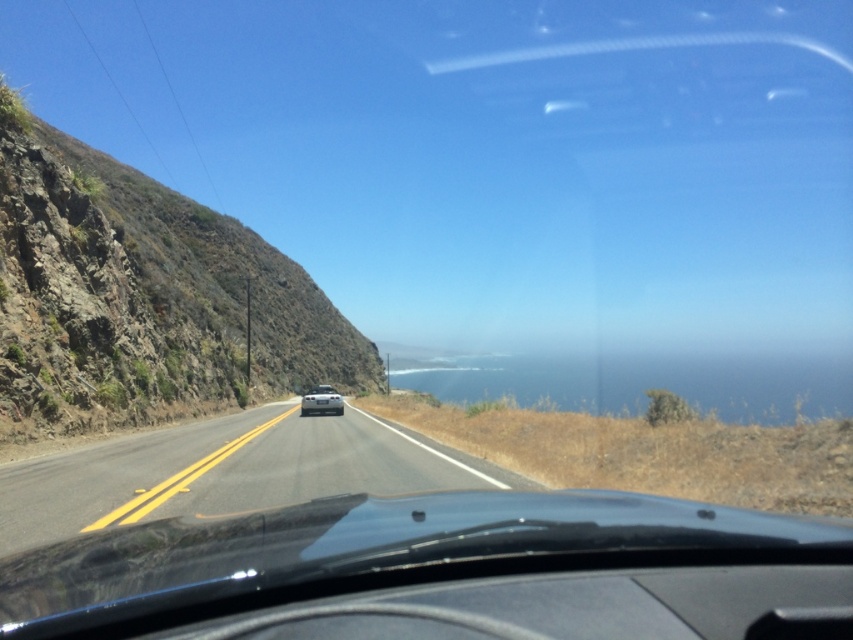
Between point (83, 266) and point (608, 451), which one is positioned behind?

The point (83, 266) is more distant.

This screenshot has height=640, width=853. Identify the location of rugged rock cliff at left. (143, 298).

Is dry grass at right taller than silver metallic car at center?

In fact, dry grass at right may be shorter than silver metallic car at center.

What do you see at coordinates (647, 452) in the screenshot?
I see `dry grass at right` at bounding box center [647, 452].

This screenshot has width=853, height=640. Describe the element at coordinates (647, 452) in the screenshot. I see `dry grass at right` at that location.

This screenshot has height=640, width=853. I want to click on dry grass at right, so click(647, 452).

Measure the distance from black asphalt road at center to silver metallic car at center.

47.14 feet

Does black asphalt road at center appear over silver metallic car at center?

Correct, black asphalt road at center is located above silver metallic car at center.

Where is `black asphalt road at center`? black asphalt road at center is located at coordinates (225, 472).